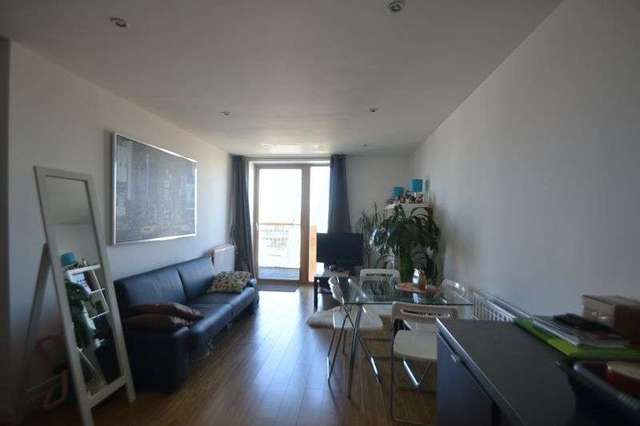
Where is `table`? This screenshot has width=640, height=426. table is located at coordinates (507, 364).